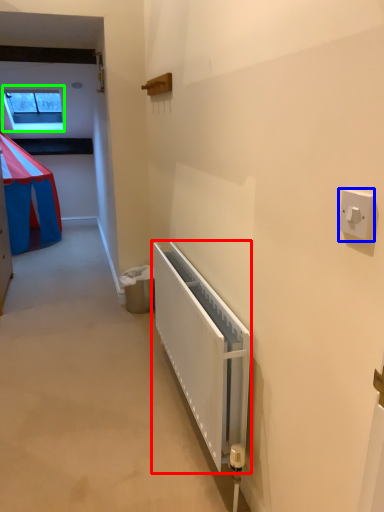
Question: Considering the real-world distances, which object is closest to radiator (highlighted by a red box)? light switch (highlighted by a blue box) or window (highlighted by a green box).

Choices:
 (A) light switch
 (B) window

Answer: (A)